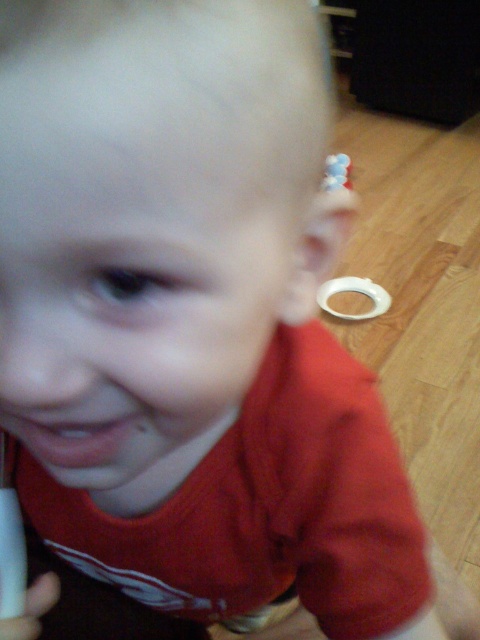
Question: Among these objects, which one is nearest to the camera?

Choices:
 (A) pink matte lips at center
 (B) white plastic toy at upper right

Answer: (A)

Question: Is pink matte lips at center positioned behind white plastic toy at upper right?

Choices:
 (A) no
 (B) yes

Answer: (A)

Question: Is pink matte lips at center further to camera compared to white plastic toy at upper right?

Choices:
 (A) yes
 (B) no

Answer: (B)

Question: Which point is closer to the camera?

Choices:
 (A) (79, 452)
 (B) (346, 186)

Answer: (A)

Question: Is pink matte lips at center positioned behind white plastic toy at upper right?

Choices:
 (A) no
 (B) yes

Answer: (A)

Question: Which point is closer to the camera?

Choices:
 (A) (60, 465)
 (B) (346, 184)

Answer: (A)